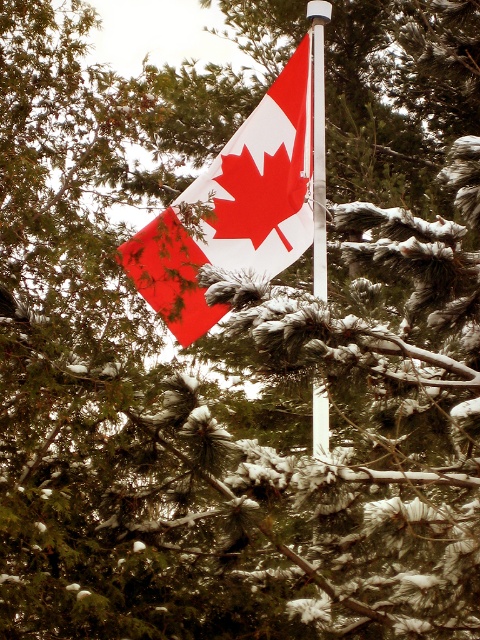
What do you see at coordinates (236, 208) in the screenshot?
I see `matte plastic flag at center` at bounding box center [236, 208].

Identify the location of matte plastic flag at center. This screenshot has height=640, width=480. (236, 208).